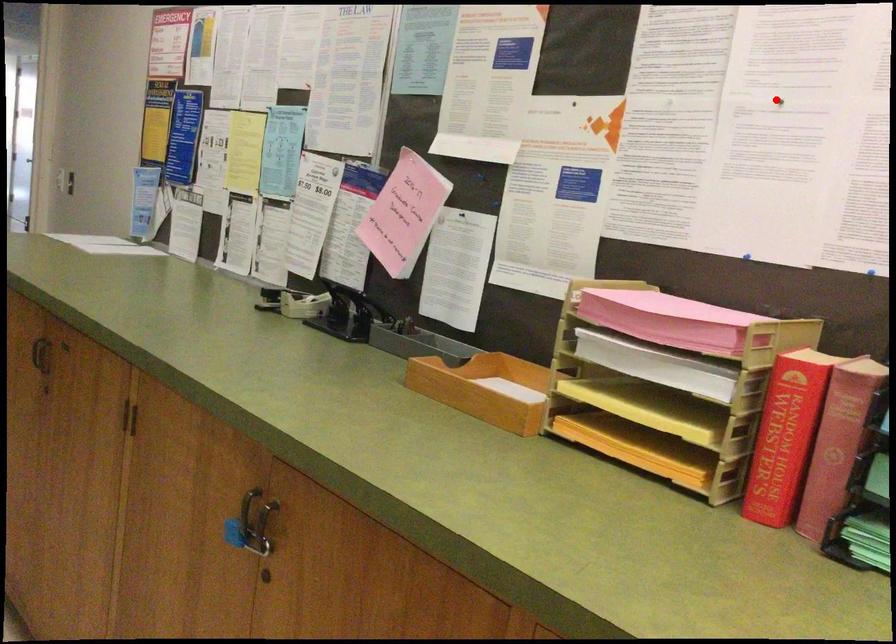
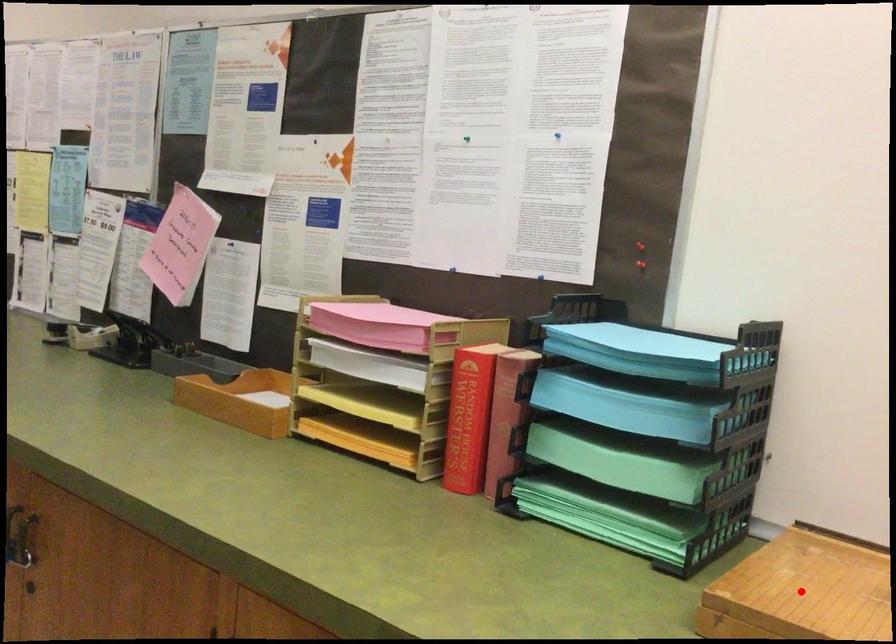
I am providing you with two images of the same scene from different viewpoints. A red point is marked on the first image and another point is marked on the second image. Do the highlighted points in image1 and image2 indicate the same real-world spot?

No